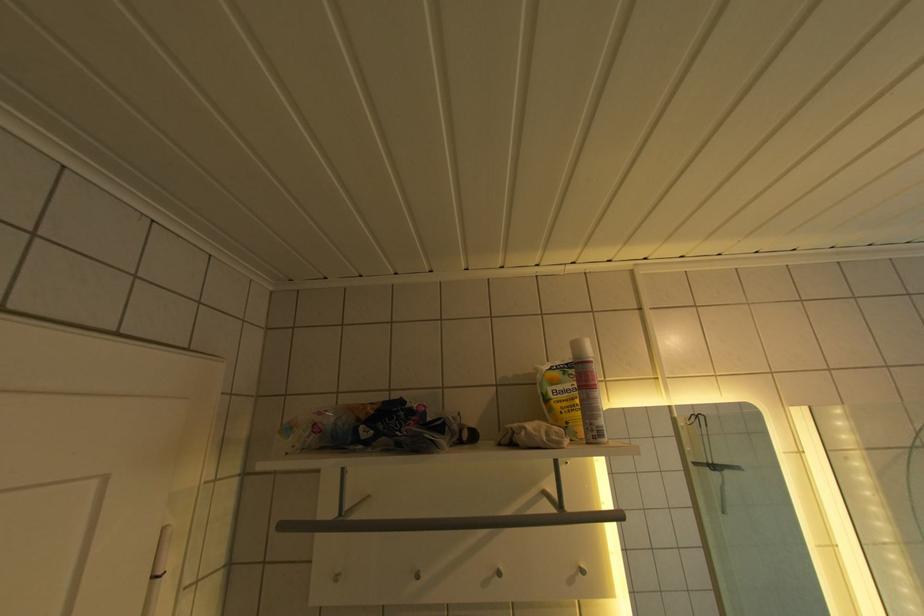
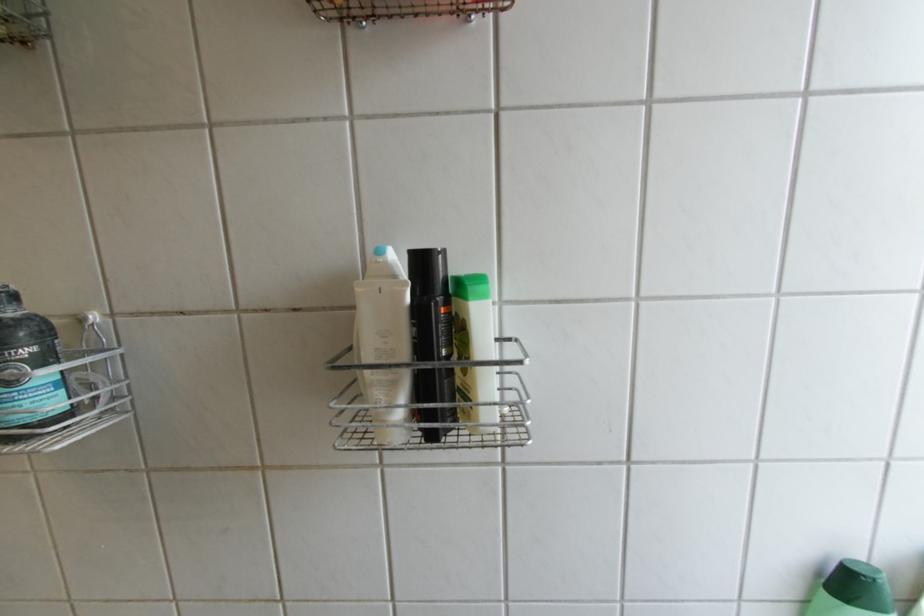
Question: What movement of the cameraman would produce the second image?

Choices:
 (A) Left
 (B) Right
 (C) Forward
 (D) Backward

Answer: (B)